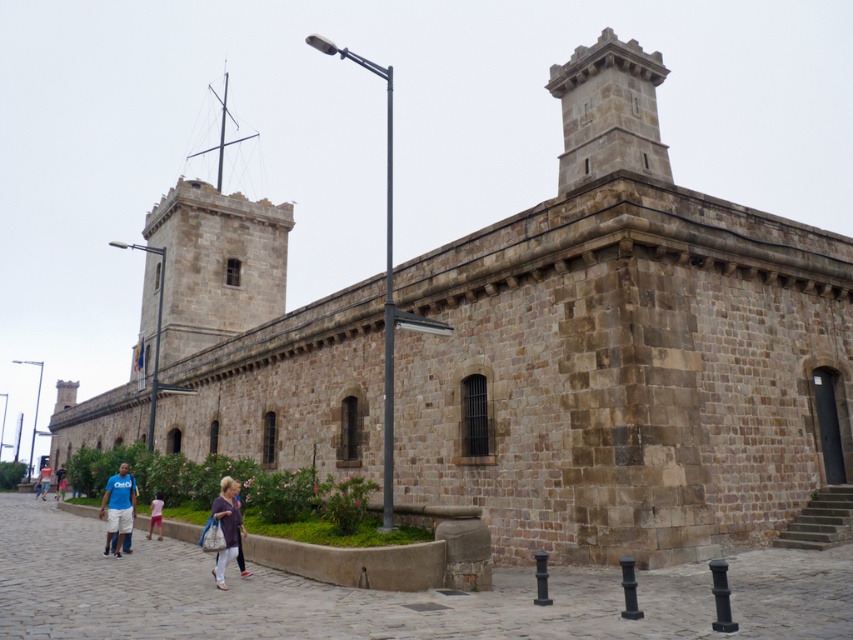
Who is higher up, matte blue shirt at lower left or blue denim jeans at lower left?

matte blue shirt at lower left

Which is more to the right, matte blue shirt at lower left or blue denim jeans at lower left?

matte blue shirt at lower left

Is point (115, 554) farther from camera compared to point (56, 490)?

No, it is not.

Identify the location of matte blue shirt at lower left. (119, 508).

Can you confirm if light blue denim shorts at lower left is positioned below blue denim jeans at lower left?

Correct, light blue denim shorts at lower left is located below blue denim jeans at lower left.

Identify the location of light blue denim shorts at lower left. (44, 480).

Does gray stone tower at upper right appear on the right side of light blue denim shorts at lower left?

Correct, you'll find gray stone tower at upper right to the right of light blue denim shorts at lower left.

Between gray stone tower at upper right and light blue denim shorts at lower left, which one is positioned lower?

Positioned lower is light blue denim shorts at lower left.

What are the coordinates of `gray stone tower at upper right` in the screenshot? It's located at (608, 112).